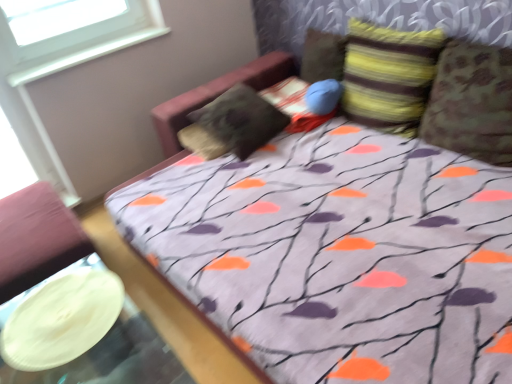
The height and width of the screenshot is (384, 512). What are the coordinates of `striped fabric pillow at upper right, positioned as the 3th pillow in left-to-right order` in the screenshot? It's located at (389, 76).

From the image's perspective, is white glossy platter at lower left on top of striped fabric pillow at upper center, which is the 3th pillow from right to left?

No, from the image's perspective, white glossy platter at lower left is not above striped fabric pillow at upper center, which is the 3th pillow from right to left.

From a real-world perspective, which object stands above the other?

striped fabric pillow at upper center, the second pillow from the left, from a real-world perspective.

Does white glossy platter at lower left turn towards striped fabric pillow at upper center, which is the 3th pillow from right to left?

No, white glossy platter at lower left is not oriented towards striped fabric pillow at upper center, which is the 3th pillow from right to left.

Between point (197, 119) and point (499, 96), which one is positioned behind?

The point (197, 119) is farther.

Does velvety brown pillow at center, which ranks as the first pillow in left-to-right order, have a smaller size compared to camouflage fabric pillow at right, which ranks as the 1th pillow in right-to-left order?

No.

From the image's perspective, who appears lower, velvety brown pillow at center, which ranks as the first pillow in left-to-right order, or camouflage fabric pillow at right, which ranks as the 1th pillow in right-to-left order?

camouflage fabric pillow at right, which ranks as the 1th pillow in right-to-left order.

Who is shorter, velvety brown pillow at center, which ranks as the first pillow in left-to-right order, or camouflage fabric pillow at right, which ranks as the 1th pillow in right-to-left order?

velvety brown pillow at center, which ranks as the first pillow in left-to-right order, is shorter.

Is camouflage fabric pillow at right, which ranks as the 1th pillow in right-to-left order, completely or partially outside of striped fabric pillow at upper right, which ranks as the second pillow in right-to-left order?

Yes.

Based on the photo, does camouflage fabric pillow at right, which ranks as the 1th pillow in right-to-left order, appear on the right side of striped fabric pillow at upper right, which ranks as the second pillow in right-to-left order?

Yes.

Is camouflage fabric pillow at right, which ranks as the 1th pillow in right-to-left order, behind striped fabric pillow at upper right, which ranks as the second pillow in right-to-left order?

No.

Could you tell me if camouflage fabric pillow at right, which ranks as the 1th pillow in right-to-left order, is facing striped fabric pillow at upper right, which ranks as the second pillow in right-to-left order?

No, camouflage fabric pillow at right, which ranks as the 1th pillow in right-to-left order, does not turn towards striped fabric pillow at upper right, which ranks as the second pillow in right-to-left order.

From the image's perspective, is white glossy platter at lower left located above white plastic window at upper left?

No, from the image's perspective, white glossy platter at lower left is not above white plastic window at upper left.

Between point (49, 327) and point (0, 27), which one is positioned behind?

The point (0, 27) is farther.

Does white glossy platter at lower left have a larger size compared to white plastic window at upper left?

Incorrect, white glossy platter at lower left is not larger than white plastic window at upper left.

Could you tell me if white glossy platter at lower left is facing white plastic window at upper left?

No, white glossy platter at lower left does not turn towards white plastic window at upper left.

In the scene shown: From the image's perspective, is white plastic window at upper left positioned above or below velvety brown pillow at center, which ranks as the first pillow in left-to-right order?

From the image's perspective, white plastic window at upper left appears above velvety brown pillow at center, which ranks as the first pillow in left-to-right order.

Considering the sizes of objects white plastic window at upper left and velvety brown pillow at center, which ranks as the first pillow in left-to-right order, in the image provided, who is thinner, white plastic window at upper left or velvety brown pillow at center, which ranks as the first pillow in left-to-right order,?

white plastic window at upper left.

From a real-world perspective, count 4th pillows downward from the white plastic window at upper left and point to it. Please provide its 2D coordinates.

[(233, 124)]

What's the angular difference between white plastic window at upper left and velvety brown pillow at center, which ranks as the first pillow in left-to-right order,'s facing directions?

The facing directions of white plastic window at upper left and velvety brown pillow at center, which ranks as the first pillow in left-to-right order, are 90.1 degrees apart.

Who is smaller, striped fabric pillow at upper right, positioned as the 3th pillow in left-to-right order, or striped fabric pillow at upper center, the second pillow from the left?

striped fabric pillow at upper center, the second pillow from the left, is smaller.

From a real-world perspective, count 1st pillows downward from the striped fabric pillow at upper right, which ranks as the second pillow in right-to-left order, and point to it. Please provide its 2D coordinates.

[(322, 56)]

Does striped fabric pillow at upper right, positioned as the 3th pillow in left-to-right order, have a greater height compared to striped fabric pillow at upper center, which is the 3th pillow from right to left?

Yes.

I want to click on the 1st pillow below when counting from the striped fabric pillow at upper right, which ranks as the second pillow in right-to-left order (from the image's perspective), so click(233, 124).

Measure the distance from velvety brown pillow at center, marked as the 4th pillow in a right-to-left arrangement, to striped fabric pillow at upper right, positioned as the 3th pillow in left-to-right order.

They are 57.27 centimeters apart.

Which object is thinner, velvety brown pillow at center, marked as the 4th pillow in a right-to-left arrangement, or striped fabric pillow at upper right, which ranks as the second pillow in right-to-left order?

striped fabric pillow at upper right, which ranks as the second pillow in right-to-left order.

From a real-world perspective, relative to striped fabric pillow at upper right, which ranks as the second pillow in right-to-left order, is velvety brown pillow at center, marked as the 4th pillow in a right-to-left arrangement, vertically above or below?

Clearly, from a real-world perspective, velvety brown pillow at center, marked as the 4th pillow in a right-to-left arrangement, is below striped fabric pillow at upper right, which ranks as the second pillow in right-to-left order.

Locate an element on the screen. This screenshot has width=512, height=384. the 4th pillow positioned above the white glossy platter at lower left (from the image's perspective) is located at coordinates (322, 56).

I want to click on pillow that appears below the camouflage fabric pillow at right, the 4th pillow positioned from the left (from a real-world perspective), so click(233, 124).

When comparing their distances from white glossy platter at lower left, does striped fabric pillow at upper center, which is the 3th pillow from right to left, or velvety brown pillow at center, which ranks as the first pillow in left-to-right order, seem closer?

velvety brown pillow at center, which ranks as the first pillow in left-to-right order, lies closer to white glossy platter at lower left than the other object.

Looking at the image, which one is located closer to white plastic window at upper left, striped fabric pillow at upper center, the second pillow from the left, or striped fabric pillow at upper right, positioned as the 3th pillow in left-to-right order?

Among the two, striped fabric pillow at upper center, the second pillow from the left, is located nearer to white plastic window at upper left.

From the image, which object appears to be farther from white glossy platter at lower left, velvety brown pillow at center, which ranks as the first pillow in left-to-right order, or striped fabric pillow at upper center, which is the 3th pillow from right to left?

The object further to white glossy platter at lower left is striped fabric pillow at upper center, which is the 3th pillow from right to left.

From the image, which object appears to be farther from velvety brown pillow at center, which ranks as the first pillow in left-to-right order, striped fabric pillow at upper center, the second pillow from the left, or camouflage fabric pillow at right, the 4th pillow positioned from the left?

Based on the image, camouflage fabric pillow at right, the 4th pillow positioned from the left, appears to be further to velvety brown pillow at center, which ranks as the first pillow in left-to-right order.

Estimate the real-world distances between objects in this image. Which object is closer to white glossy platter at lower left, striped fabric pillow at upper center, the second pillow from the left, or white plastic window at upper left?

white plastic window at upper left lies closer to white glossy platter at lower left than the other object.

Which object lies nearer to the anchor point striped fabric pillow at upper right, positioned as the 3th pillow in left-to-right order, camouflage fabric pillow at right, the 4th pillow positioned from the left, or white plastic window at upper left?

camouflage fabric pillow at right, the 4th pillow positioned from the left.

Estimate the real-world distances between objects in this image. Which object is closer to velvety brown pillow at center, marked as the 4th pillow in a right-to-left arrangement, striped fabric pillow at upper right, positioned as the 3th pillow in left-to-right order, or white plastic window at upper left?

striped fabric pillow at upper right, positioned as the 3th pillow in left-to-right order, is positioned closer to the anchor velvety brown pillow at center, marked as the 4th pillow in a right-to-left arrangement.

Which object lies nearer to the anchor point striped fabric pillow at upper right, which ranks as the second pillow in right-to-left order, white plastic window at upper left or camouflage fabric pillow at right, the 4th pillow positioned from the left?

camouflage fabric pillow at right, the 4th pillow positioned from the left.

Identify the location of pillow between velvety brown pillow at center, which ranks as the first pillow in left-to-right order, and striped fabric pillow at upper right, which ranks as the second pillow in right-to-left order, from left to right. (322, 56).

Locate an element on the screen. This screenshot has width=512, height=384. platter between white plastic window at upper left and striped fabric pillow at upper right, positioned as the 3th pillow in left-to-right order, from left to right is located at coordinates (62, 319).

Find the location of a particular element. Image resolution: width=512 pixels, height=384 pixels. pillow situated between white plastic window at upper left and striped fabric pillow at upper center, which is the 3th pillow from right to left, from left to right is located at coordinates (233, 124).

Where is `platter situated between white plastic window at upper left and camouflage fabric pillow at right, the 4th pillow positioned from the left, from left to right`? platter situated between white plastic window at upper left and camouflage fabric pillow at right, the 4th pillow positioned from the left, from left to right is located at coordinates (62, 319).